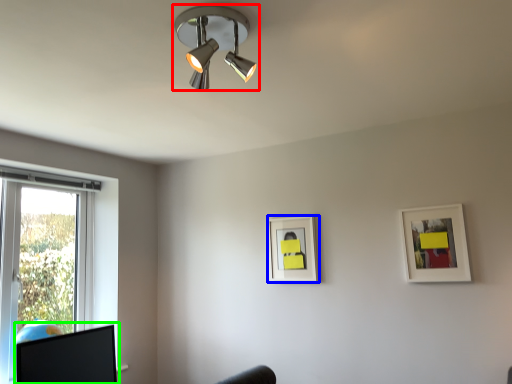
Question: Estimate the real-world distances between objects in this image. Which object is farther from lamp (highlighted by a red box), picture frame (highlighted by a blue box) or computer monitor (highlighted by a green box)?

Choices:
 (A) picture frame
 (B) computer monitor

Answer: (B)